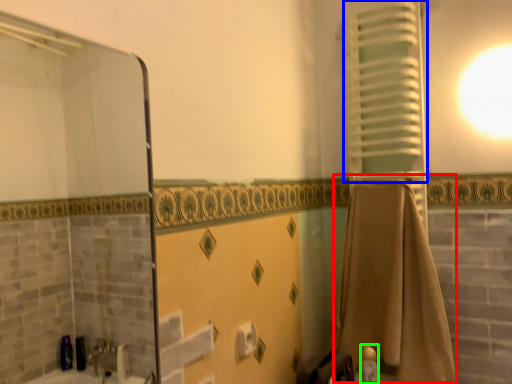
Question: Which object is positioned closest to bath towel (highlighted by a red box)? Select from curtain (highlighted by a blue box) and toiletry (highlighted by a green box).

Choices:
 (A) curtain
 (B) toiletry

Answer: (B)